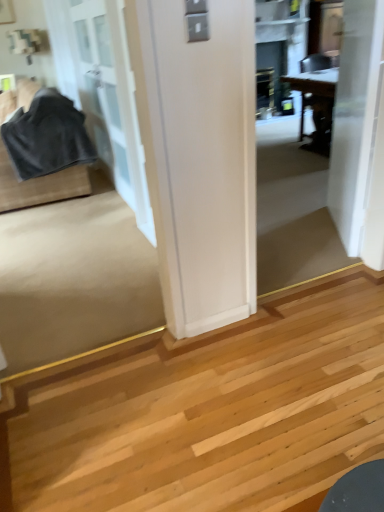
Question: Can you confirm if white glass door at left, the 2th door when ordered from right to left, is taller than velvet-like black fabric at left?

Choices:
 (A) yes
 (B) no

Answer: (A)

Question: Does white glass door at left, the 2th door when ordered from right to left, have a larger size compared to velvet-like black fabric at left?

Choices:
 (A) yes
 (B) no

Answer: (A)

Question: Is velvet-like black fabric at left located within white glass door at left, arranged as the 1th door when viewed from the left?

Choices:
 (A) no
 (B) yes

Answer: (A)

Question: From the image's perspective, is white glass door at left, arranged as the 1th door when viewed from the left, beneath velvet-like black fabric at left?

Choices:
 (A) yes
 (B) no

Answer: (B)

Question: Does white glass door at left, the 2th door when ordered from right to left, have a lesser width compared to velvet-like black fabric at left?

Choices:
 (A) yes
 (B) no

Answer: (A)

Question: From a real-world perspective, relative to velvet-like black fabric at left, is white smooth door at upper right, which ranks as the second door in left-to-right order, vertically above or below?

Choices:
 (A) below
 (B) above

Answer: (B)

Question: In terms of width, does white smooth door at upper right, which ranks as the first door in right-to-left order, look wider or thinner when compared to velvet-like black fabric at left?

Choices:
 (A) thin
 (B) wide

Answer: (A)

Question: Would you say white smooth door at upper right, which ranks as the first door in right-to-left order, is to the left or to the right of velvet-like black fabric at left in the picture?

Choices:
 (A) left
 (B) right

Answer: (B)

Question: Relative to velvet-like black fabric at left, is white smooth door at upper right, which ranks as the second door in left-to-right order, in front or behind?

Choices:
 (A) front
 (B) behind

Answer: (A)

Question: In the image, is velvet-like black fabric at left on the left side or the right side of white glass door at left, arranged as the 1th door when viewed from the left?

Choices:
 (A) right
 (B) left

Answer: (B)

Question: From the image's perspective, relative to white glass door at left, the 2th door when ordered from right to left, is velvet-like black fabric at left above or below?

Choices:
 (A) below
 (B) above

Answer: (A)

Question: Considering the positions of velvet-like black fabric at left and white glass door at left, the 2th door when ordered from right to left, in the image, is velvet-like black fabric at left taller or shorter than white glass door at left, the 2th door when ordered from right to left,?

Choices:
 (A) short
 (B) tall

Answer: (A)

Question: From a real-world perspective, is velvet-like black fabric at left physically located above or below white glass door at left, the 2th door when ordered from right to left?

Choices:
 (A) below
 (B) above

Answer: (A)

Question: From their relative heights in the image, would you say white glass door at left, the 2th door when ordered from right to left, is taller or shorter than velvet-like black fabric at left?

Choices:
 (A) tall
 (B) short

Answer: (A)

Question: Considering the relative positions of white glass door at left, arranged as the 1th door when viewed from the left, and velvet-like black fabric at left in the image provided, is white glass door at left, arranged as the 1th door when viewed from the left, to the left or to the right of velvet-like black fabric at left?

Choices:
 (A) right
 (B) left

Answer: (A)